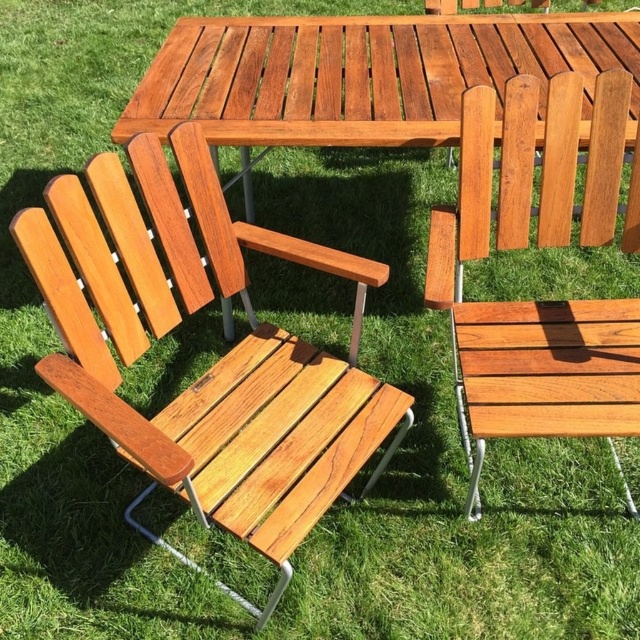
You are sitting on the grassy lawn and want to move to the glossy wood picnic table at center. Which direction should you move relative to the natural wood chair at left?

You should move to the right relative to the natural wood chair at left because the glossy wood picnic table at center is located to the right of the natural wood chair at left.

You are planning to place a rectangular table between the two natural wood chairs. Given the distance between the natural wood chair at left and the natural wood chair at center, will the table fit perfectly between them?

The natural wood chair at left and natural wood chair at center are 21.29 inches apart from each other. The table requires 21.29 inches of space to fit perfectly between them, so yes, the table will fit perfectly between the two chairs.